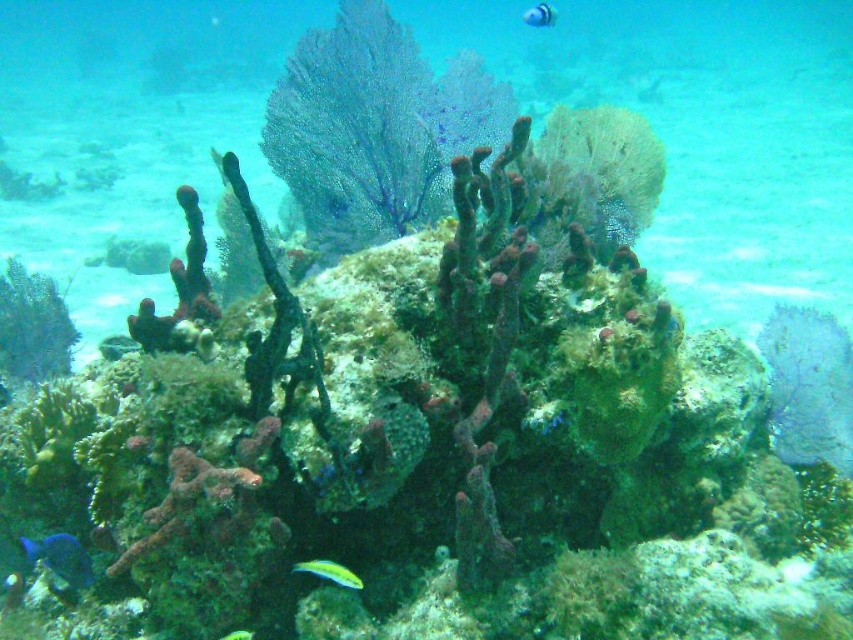
Question: In this image, where is blue glossy fish at upper center located relative to shiny green fish at center?

Choices:
 (A) left
 (B) right

Answer: (B)

Question: Can you confirm if translucent purple coral at upper left is positioned to the right of shiny green fish at center?

Choices:
 (A) yes
 (B) no

Answer: (B)

Question: Considering the real-world distances, which object is farthest from the shiny blue fish at lower left?

Choices:
 (A) translucent purple coral at center
 (B) blue glossy fish at upper center
 (C) shiny yellow fish at center
 (D) translucent purple coral at upper left

Answer: (B)

Question: Which is farther from the blue glossy fish at upper center?

Choices:
 (A) translucent purple coral at upper left
 (B) shiny yellow fish at center
 (C) translucent purple coral at center

Answer: (B)

Question: In this image, where is translucent purple coral at center located relative to shiny green fish at center?

Choices:
 (A) left
 (B) right

Answer: (B)

Question: Among these objects, which one is farthest from the camera?

Choices:
 (A) shiny green fish at center
 (B) shiny yellow fish at center

Answer: (A)